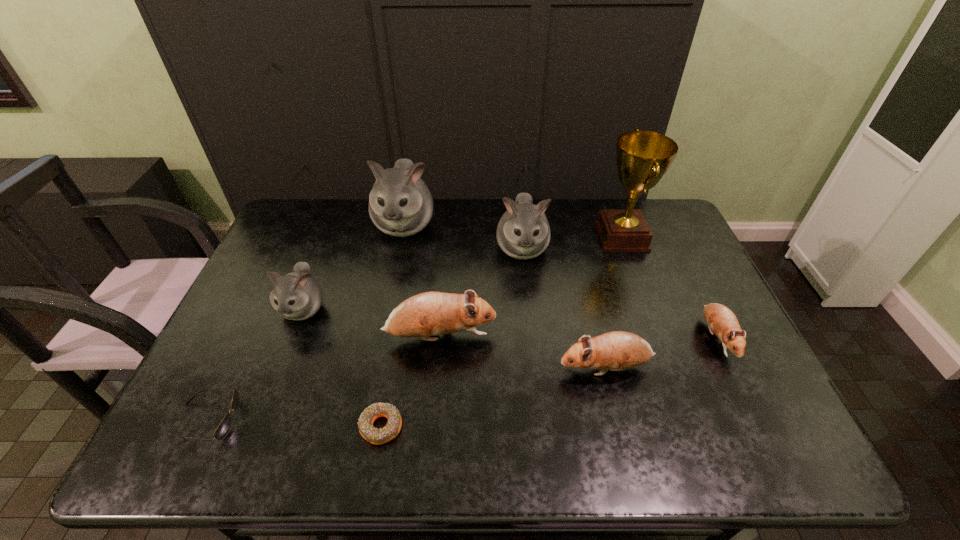
You are a GUI agent. You are given a task and a screenshot of the screen. Output one action in this format:
    pyautogui.click(x=<x>, y=<y>)
    Task: Click on the vacant space at the right edge
    The image size is (960, 540).
    Given the screenshot: What is the action you would take?
    pyautogui.click(x=687, y=275)

Where is `free point at the near left corner`? This screenshot has height=540, width=960. free point at the near left corner is located at coordinates (205, 434).

Image resolution: width=960 pixels, height=540 pixels. What are the coordinates of `free space at the far right corner of the desktop` in the screenshot? It's located at (660, 237).

You are a GUI agent. You are given a task and a screenshot of the screen. Output one action in this format:
    pyautogui.click(x=<x>, y=<y>)
    Task: Click on the free space between the second tallest object and the biggest brown hamster
    Image resolution: width=960 pixels, height=540 pixels.
    Given the screenshot: What is the action you would take?
    pyautogui.click(x=422, y=281)

Locate an element on the screen. This screenshot has height=540, width=960. vacant region between the second smallest white hamster and the eighth tallest object is located at coordinates (365, 334).

Where is `vacant space in between the second shortest object and the rightmost white hamster`? The height and width of the screenshot is (540, 960). vacant space in between the second shortest object and the rightmost white hamster is located at coordinates (365, 334).

This screenshot has width=960, height=540. Identify the location of vacant space that's between the second tallest hamster and the second shortest object. (365, 334).

Where is `vacant area that lies between the leftmost hamster and the tallest object`? vacant area that lies between the leftmost hamster and the tallest object is located at coordinates (463, 273).

What are the coordinates of `free space between the sunglasses and the leftmost white hamster` in the screenshot? It's located at click(x=255, y=364).

Find the location of a particular element. free point between the second white hamster from right to left and the sixth tallest object is located at coordinates (505, 296).